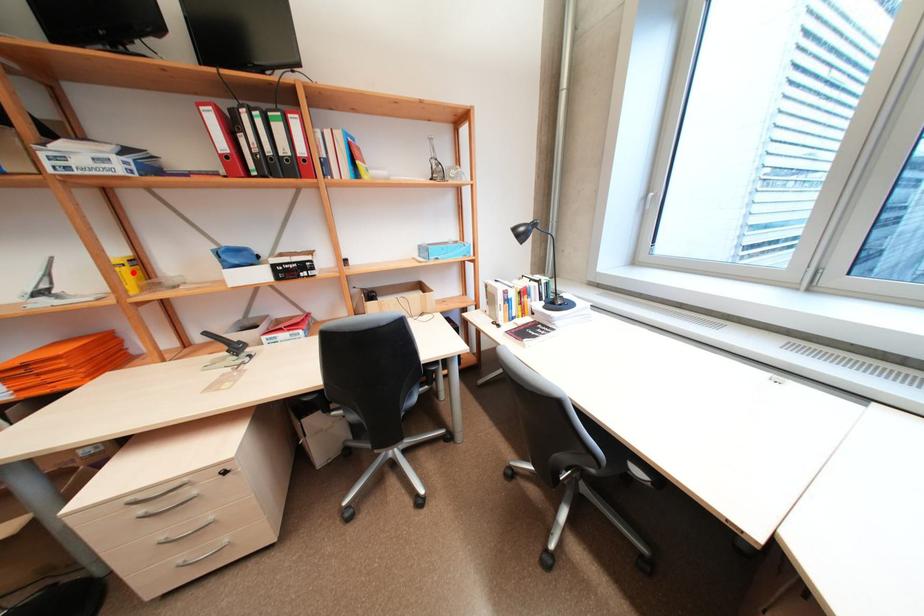
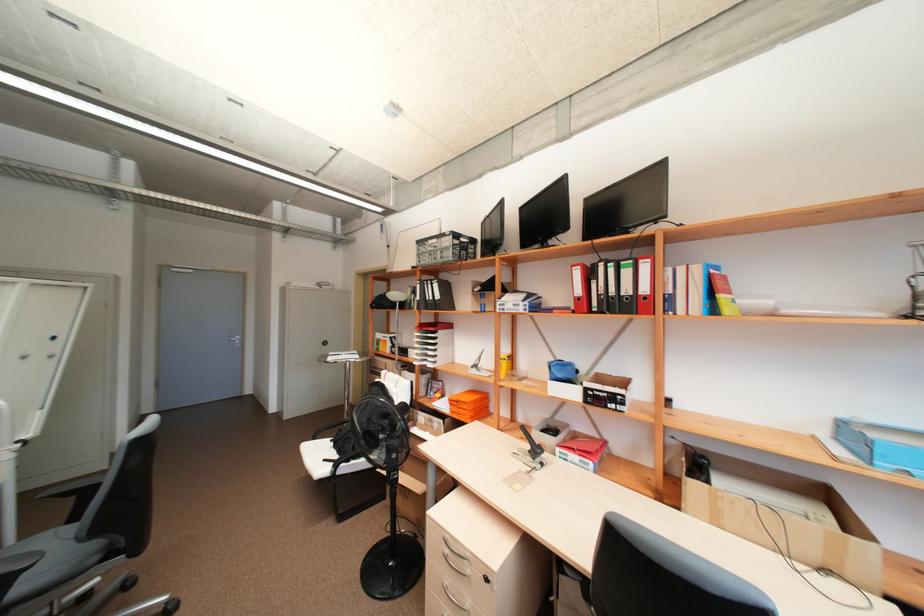
Question: I am providing you with two images of the same scene from different viewpoints. A red point is marked on the first image. Can you still see the location of the red point in image 2?

Choices:
 (A) Yes
 (B) No

Answer: (A)